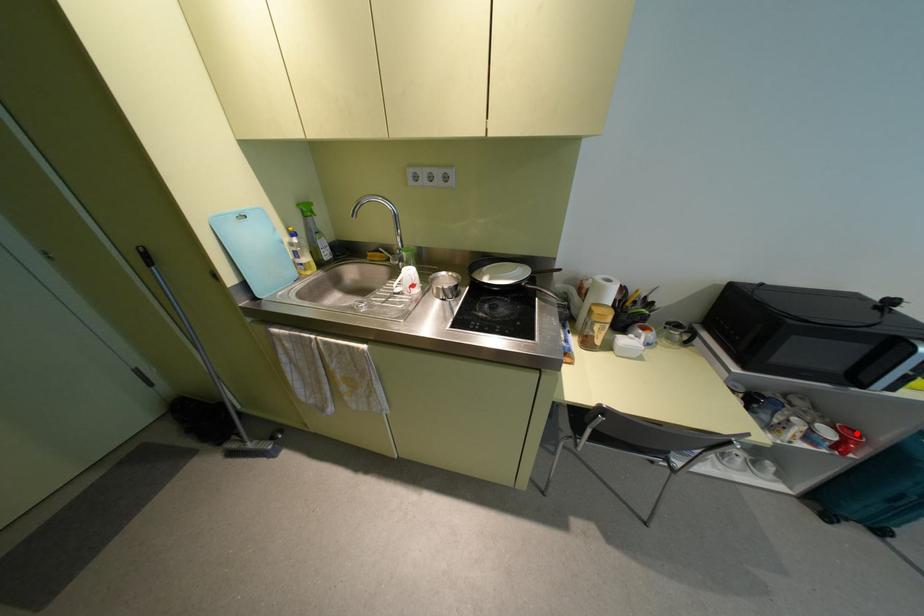
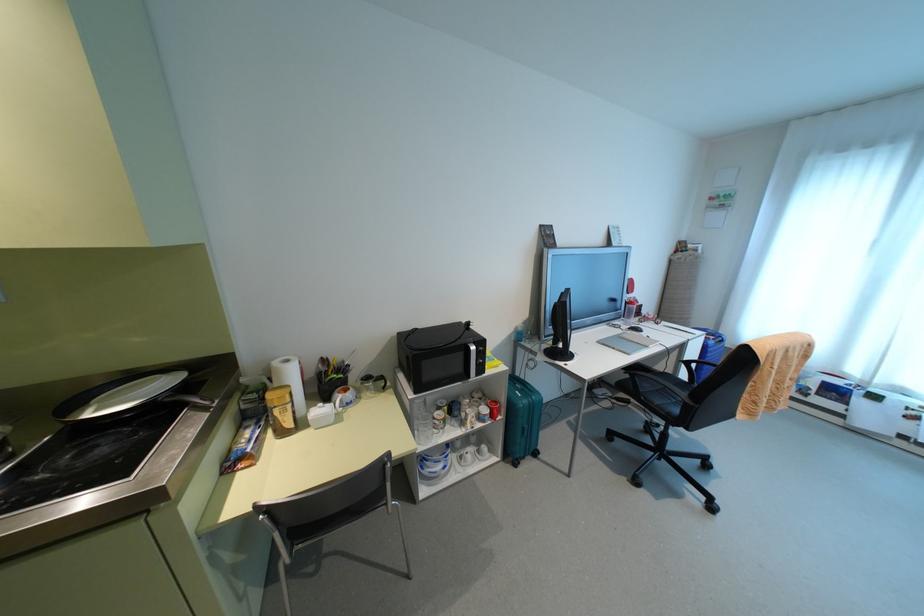
The point at the highlighted location is marked in the first image. Where is the corresponding point in the second image?

(495, 402)